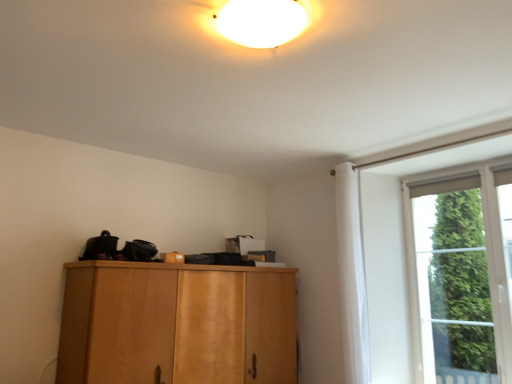
Question: From a real-world perspective, is light brown wood cabinet at center physically above green glass window at right?

Choices:
 (A) yes
 (B) no

Answer: (B)

Question: Is light brown wood cabinet at center positioned behind green glass window at right?

Choices:
 (A) yes
 (B) no

Answer: (B)

Question: Is light brown wood cabinet at center aimed at green glass window at right?

Choices:
 (A) no
 (B) yes

Answer: (B)

Question: Are light brown wood cabinet at center and green glass window at right located far from each other?

Choices:
 (A) yes
 (B) no

Answer: (A)

Question: From the image's perspective, is light brown wood cabinet at center on top of green glass window at right?

Choices:
 (A) no
 (B) yes

Answer: (A)

Question: From the image's perspective, is green glass window at right located above or below light brown wood cabinet at center?

Choices:
 (A) below
 (B) above

Answer: (B)

Question: In the image, is green glass window at right positioned in front of or behind light brown wood cabinet at center?

Choices:
 (A) behind
 (B) front

Answer: (A)

Question: Is green glass window at right wider or thinner than light brown wood cabinet at center?

Choices:
 (A) wide
 (B) thin

Answer: (B)

Question: From a real-world perspective, is green glass window at right above or below light brown wood cabinet at center?

Choices:
 (A) below
 (B) above

Answer: (B)

Question: From a real-world perspective, is white fabric curtain at right positioned above or below green glass window at right?

Choices:
 (A) below
 (B) above

Answer: (B)

Question: Does point (344, 359) appear closer or farther from the camera than point (471, 175)?

Choices:
 (A) farther
 (B) closer

Answer: (B)

Question: Is white fabric curtain at right spatially inside green glass window at right, or outside of it?

Choices:
 (A) outside
 (B) inside

Answer: (A)

Question: Is white fabric curtain at right wider or thinner than green glass window at right?

Choices:
 (A) thin
 (B) wide

Answer: (B)

Question: In terms of width, does white fabric curtain at right look wider or thinner when compared to light brown wood cabinet at center?

Choices:
 (A) wide
 (B) thin

Answer: (B)

Question: Considering the positions of white fabric curtain at right and light brown wood cabinet at center in the image, is white fabric curtain at right taller or shorter than light brown wood cabinet at center?

Choices:
 (A) tall
 (B) short

Answer: (A)